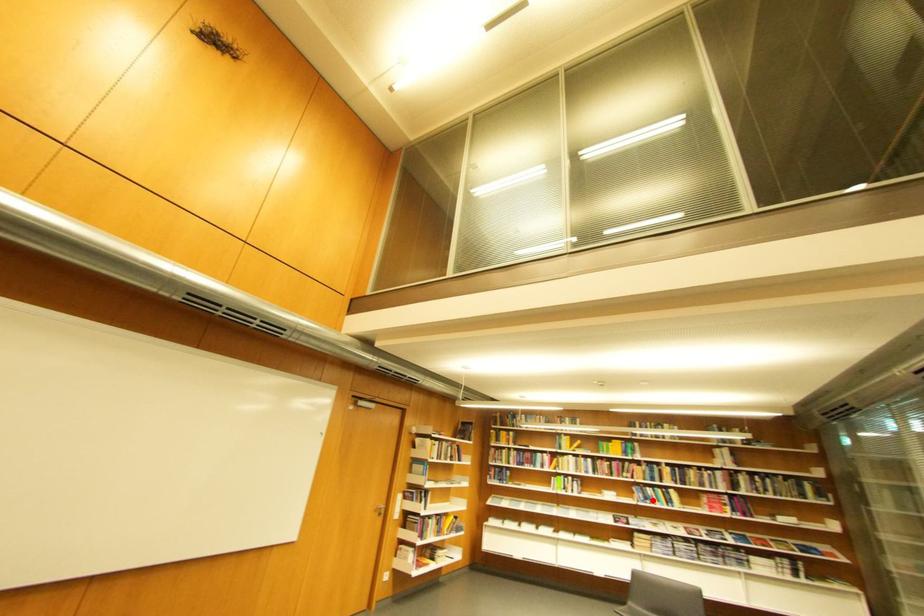
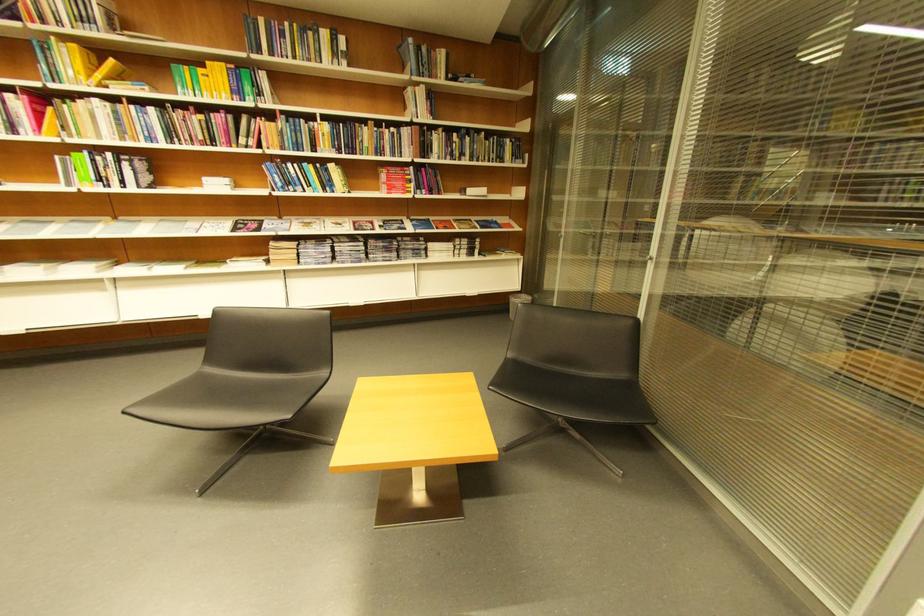
Where in the second image is the point corresponding to the highlighted location from the first image?

(290, 185)